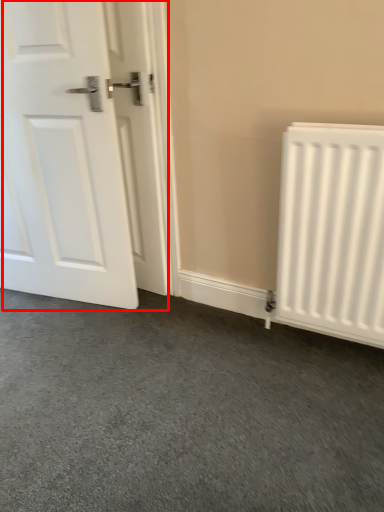
Question: From the image's perspective, where is door (annotated by the red box) located in relation to radiator in the image?

Choices:
 (A) below
 (B) above

Answer: (B)